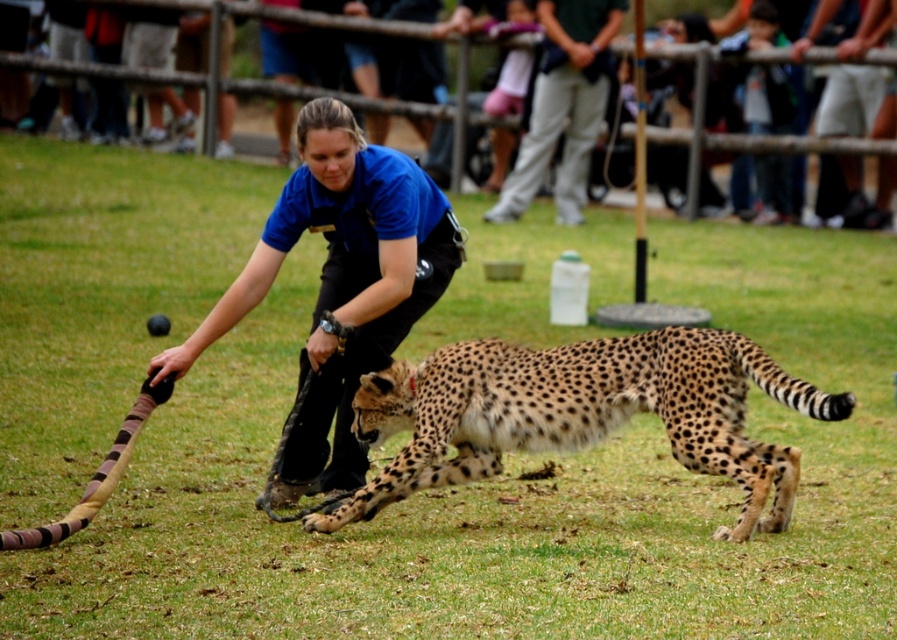
Question: Is spotted fur cheetah at center positioned at the back of blue uniform at center?

Choices:
 (A) no
 (B) yes

Answer: (A)

Question: Which point is closer to the camera taking this photo?

Choices:
 (A) (373, 148)
 (B) (411, 385)
 (C) (569, 131)

Answer: (B)

Question: Which point is farther to the camera?

Choices:
 (A) spotted fur cheetah at center
 (B) light pink fabric at upper center
 (C) blue uniform at center

Answer: (B)

Question: Which point is farther to the camera?

Choices:
 (A) spotted fur cheetah at center
 (B) blue uniform at center

Answer: (B)

Question: Can you confirm if spotted fur cheetah at center is positioned above light pink fabric at upper center?

Choices:
 (A) yes
 (B) no

Answer: (B)

Question: Is blue uniform at center behind light pink fabric at upper center?

Choices:
 (A) yes
 (B) no

Answer: (B)